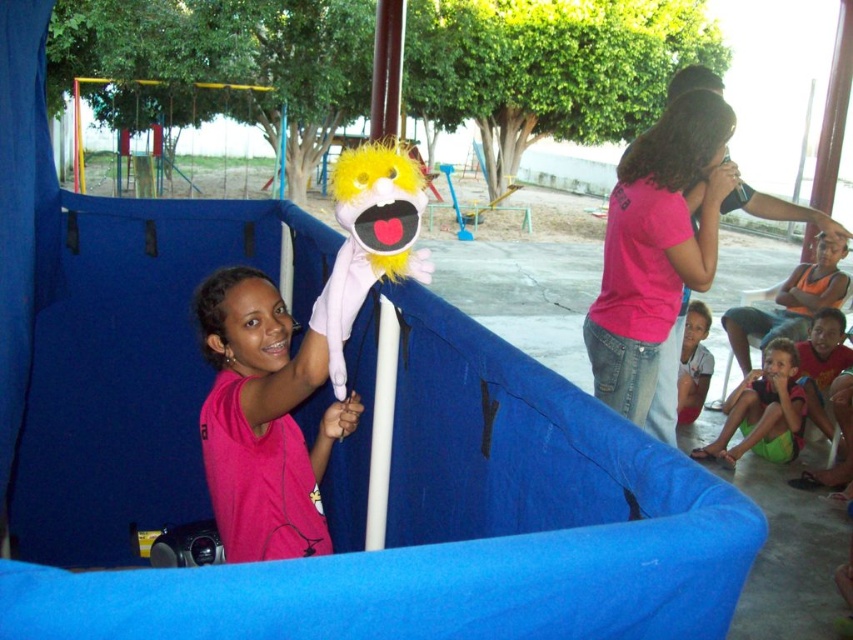
This screenshot has width=853, height=640. Describe the element at coordinates (338, 465) in the screenshot. I see `blue fabric slide at center` at that location.

Where is `blue fabric slide at center`? The width and height of the screenshot is (853, 640). blue fabric slide at center is located at coordinates (338, 465).

Is point (473, 524) positioned in front of point (206, 426)?

Yes, point (473, 524) is closer to viewer.

The width and height of the screenshot is (853, 640). I want to click on blue fabric slide at center, so click(x=338, y=465).

Find the location of a particular element. The width and height of the screenshot is (853, 640). blue fabric slide at center is located at coordinates (338, 465).

Does blue fabric slide at center have a lesser width compared to pink cotton shirt at upper right?

No, blue fabric slide at center is not thinner than pink cotton shirt at upper right.

Is point (158, 248) behind point (694, 157)?

No, it is in front of (694, 157).

Where is `blue fabric slide at center`? Image resolution: width=853 pixels, height=640 pixels. blue fabric slide at center is located at coordinates (338, 465).

Does point (315, 307) come in front of point (792, 396)?

Yes.

Who is more forward, (337, 307) or (752, 396)?

Point (337, 307)

Where is `fuzzy yellow puppet at center`? The height and width of the screenshot is (640, 853). fuzzy yellow puppet at center is located at coordinates (369, 240).